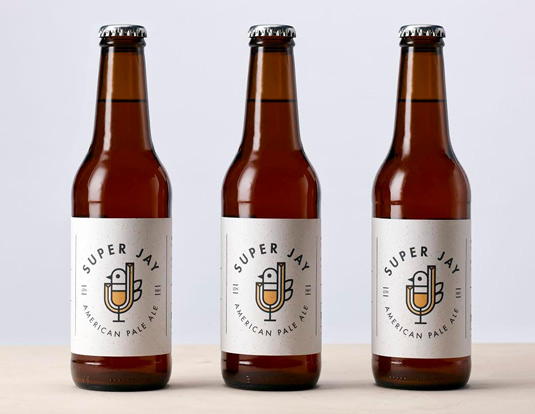
At what (x,y) coordinates should I click in order to perform the action: click on white backdrop. Please return your answer as a coordinate pair (x, y). Looking at the image, I should click on point(186,138).